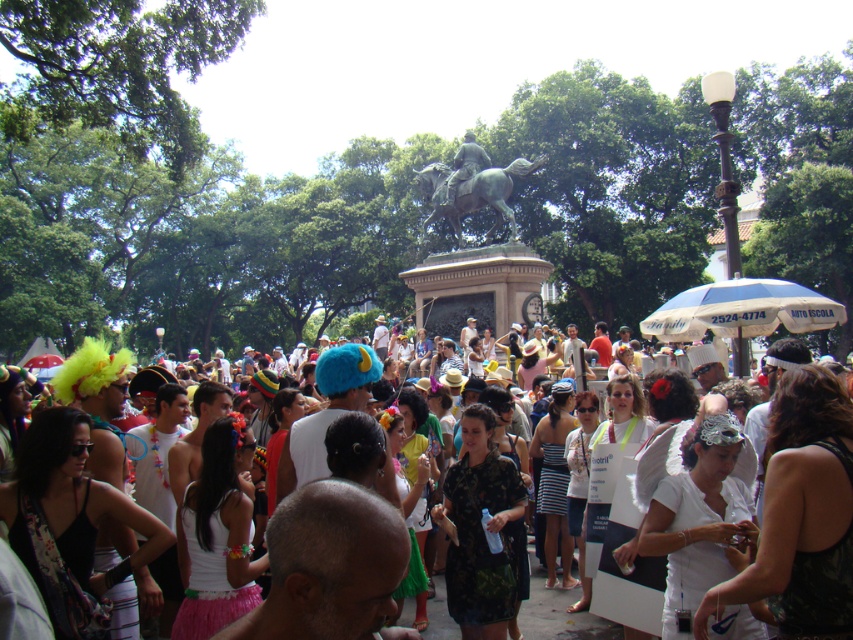
Between bronze statue at center and white cotton crowd at center, which one appears on the left side from the viewer's perspective?

bronze statue at center is more to the left.

Does bronze statue at center appear over white cotton crowd at center?

Indeed, bronze statue at center is positioned over white cotton crowd at center.

The image size is (853, 640). In order to click on bronze statue at center in this screenshot , I will do `click(473, 186)`.

Find the location of a particular element. bronze statue at center is located at coordinates (473, 186).